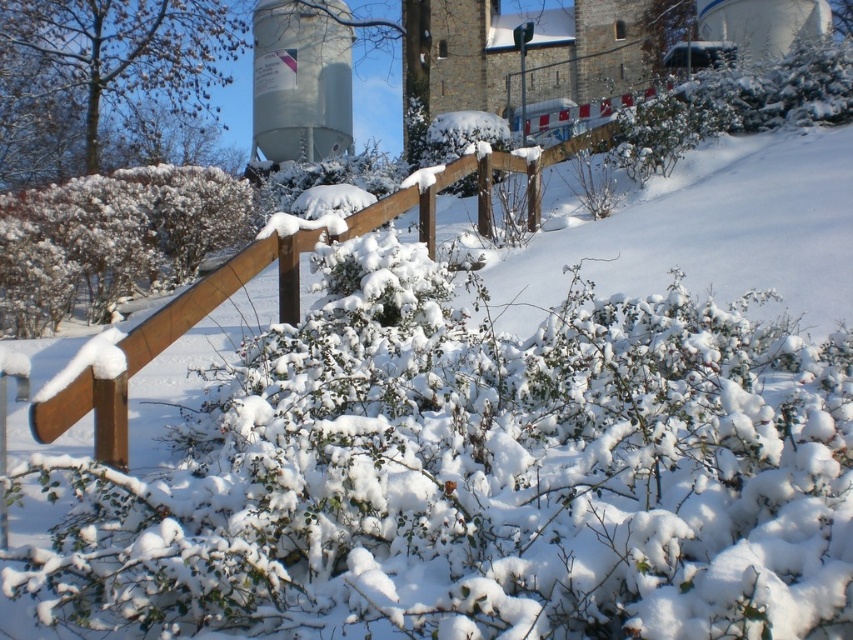
You are an artist sketching this winter scene. You want to ensure the size relationship between the white fluffy bush at left and the metallic gray water tower at upper center is accurate. Which object should you draw larger?

The white fluffy bush at left should be drawn larger than the metallic gray water tower at upper center because the white fluffy bush at left is bigger than metallic gray water tower at upper center.